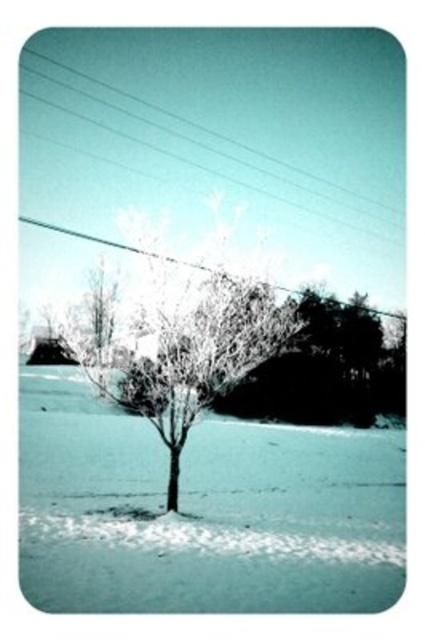
Measure the distance from metallic wire at upper center to clear plastic power line at upper center.

metallic wire at upper center and clear plastic power line at upper center are 31.77 meters apart.

Between metallic wire at upper center and clear plastic power line at upper center, which one has more height?

Result: With more height is metallic wire at upper center.

Does point (161, 129) come behind point (382, 314)?

Yes.

Identify the location of metallic wire at upper center. (214, 148).

Image resolution: width=425 pixels, height=640 pixels. What do you see at coordinates (187, 353) in the screenshot? I see `white frosty tree at center` at bounding box center [187, 353].

Consider the image. Is white frosty tree at center to the right of clear plastic power line at upper center from the viewer's perspective?

No, white frosty tree at center is not to the right of clear plastic power line at upper center.

Is point (172, 380) farther from viewer compared to point (22, 218)?

No, (172, 380) is closer to viewer.

Locate an element on the screen. white frosty tree at center is located at coordinates (187, 353).

Which is behind, point (204, 342) or point (323, 182)?

Point (323, 182)

Looking at this image, is white frosty tree at center smaller than metallic wire at upper center?

No.

What do you see at coordinates (187, 353) in the screenshot?
I see `white frosty tree at center` at bounding box center [187, 353].

Find the location of `white frosty tree at center`. white frosty tree at center is located at coordinates (187, 353).